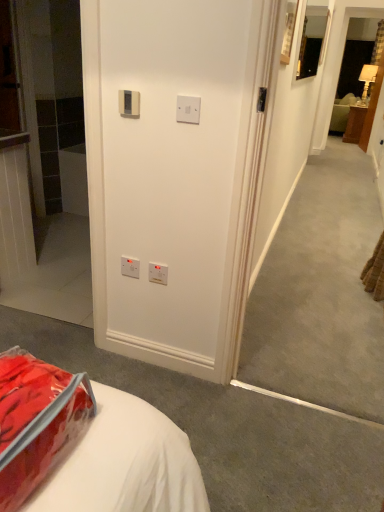
Question: Would you say beige plastic thermostat at upper center, the 4th electric outlet from the bottom, contains white plastic switch at upper center, which appears as the 2th electric outlet when viewed from the top?

Choices:
 (A) no
 (B) yes

Answer: (A)

Question: Can you confirm if beige plastic thermostat at upper center, which is the 1th electric outlet from top to bottom, is thinner than white plastic switch at upper center, which appears as the 2th electric outlet when viewed from the top?

Choices:
 (A) no
 (B) yes

Answer: (A)

Question: Is beige plastic thermostat at upper center, the third electric outlet when ordered from back to front, outside of white plastic switch at upper center, which is counted as the third electric outlet, starting from the bottom?

Choices:
 (A) no
 (B) yes

Answer: (B)

Question: From a real-world perspective, is beige plastic thermostat at upper center, the second electric outlet when ordered from front to back, located beneath white plastic switch at upper center, which ranks as the 4th electric outlet in back-to-front order?

Choices:
 (A) yes
 (B) no

Answer: (A)

Question: Could you tell me if beige plastic thermostat at upper center, the third electric outlet when ordered from back to front, is facing white plastic switch at upper center, the fourth electric outlet from the left?

Choices:
 (A) no
 (B) yes

Answer: (A)

Question: From the image's perspective, is beige plastic thermostat at upper center, the third electric outlet when ordered from back to front, on top of white plastic switch at upper center, which ranks as the 4th electric outlet in back-to-front order?

Choices:
 (A) no
 (B) yes

Answer: (B)

Question: Is translucent plastic bag at lower left to the right of wooden nightstand at right from the viewer's perspective?

Choices:
 (A) yes
 (B) no

Answer: (B)

Question: Can you confirm if translucent plastic bag at lower left is shorter than wooden nightstand at right?

Choices:
 (A) yes
 (B) no

Answer: (A)

Question: Is translucent plastic bag at lower left positioned before wooden nightstand at right?

Choices:
 (A) no
 (B) yes

Answer: (B)

Question: Would you consider translucent plastic bag at lower left to be distant from wooden nightstand at right?

Choices:
 (A) no
 (B) yes

Answer: (B)

Question: Considering the relative sizes of translucent plastic bag at lower left and wooden nightstand at right in the image provided, is translucent plastic bag at lower left thinner than wooden nightstand at right?

Choices:
 (A) no
 (B) yes

Answer: (B)

Question: Does translucent plastic bag at lower left touch wooden nightstand at right?

Choices:
 (A) no
 (B) yes

Answer: (A)

Question: From the image's perspective, is white plastic electric outlet at lower center, positioned as the first electric outlet in back-to-front order, located beneath translucent plastic bag at lower left?

Choices:
 (A) no
 (B) yes

Answer: (A)